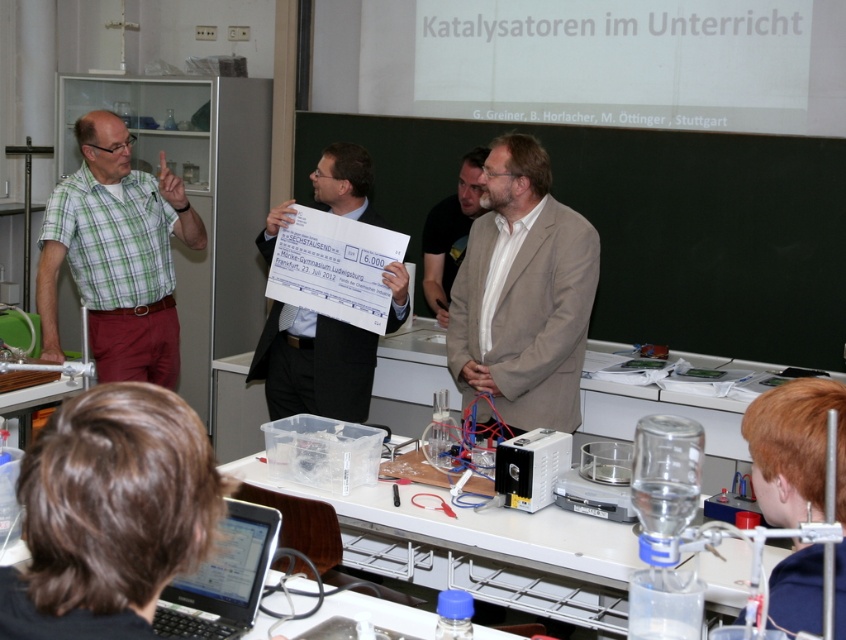
Question: Does beige fabric suit at center have a larger size compared to white paper check at center?

Choices:
 (A) no
 (B) yes

Answer: (A)

Question: Which point appears closest to the camera in this image?

Choices:
 (A) (402, 298)
 (B) (504, 246)
 (C) (658, 200)
 (D) (37, 284)

Answer: (B)

Question: Which point appears closest to the camera in this image?

Choices:
 (A) (102, 214)
 (B) (255, 545)

Answer: (B)

Question: Can you confirm if green checkered shirt at left is smaller than light brown suit at center?

Choices:
 (A) no
 (B) yes

Answer: (A)

Question: Which object appears farthest from the camera in this image?

Choices:
 (A) blackboard at center
 (B) white paper check at center

Answer: (A)

Question: Is silver metallic laptop at lower left further to the viewer compared to light brown suit at center?

Choices:
 (A) yes
 (B) no

Answer: (B)